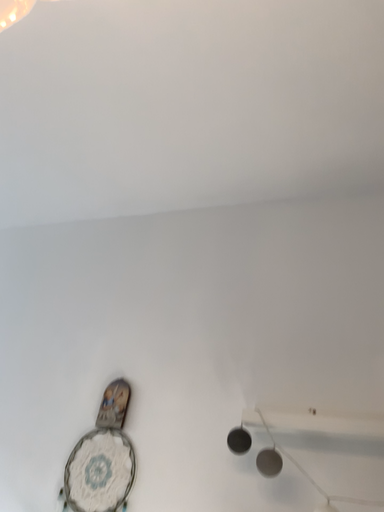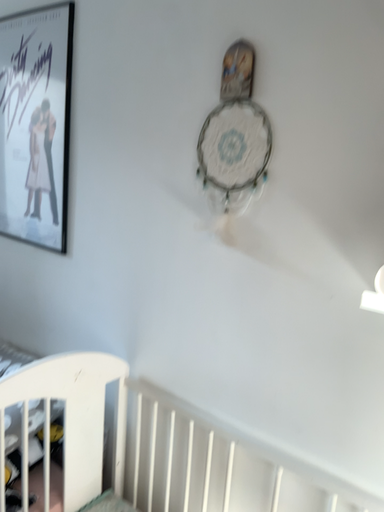
Question: How did the camera likely rotate when shooting the video?

Choices:
 (A) rotated upward
 (B) rotated downward

Answer: (B)